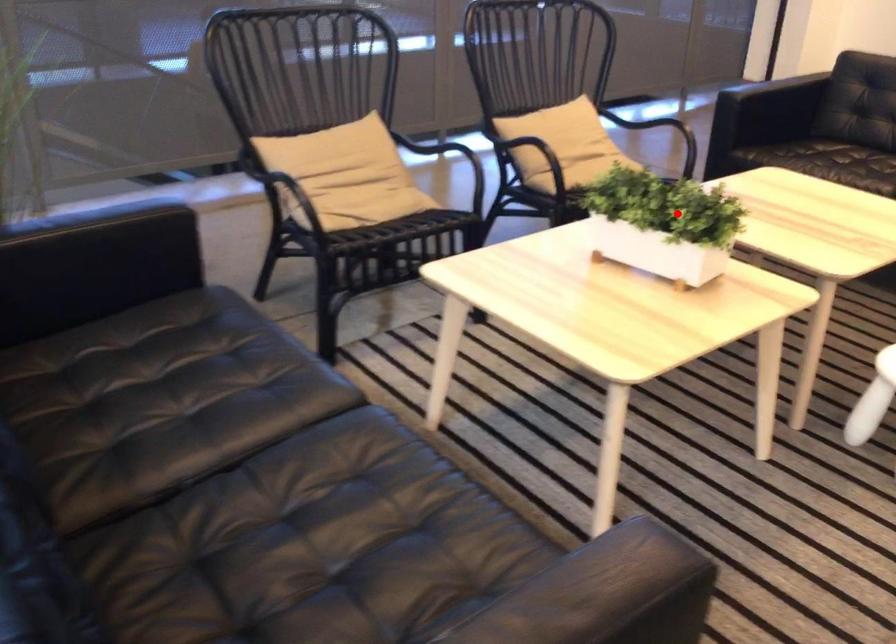
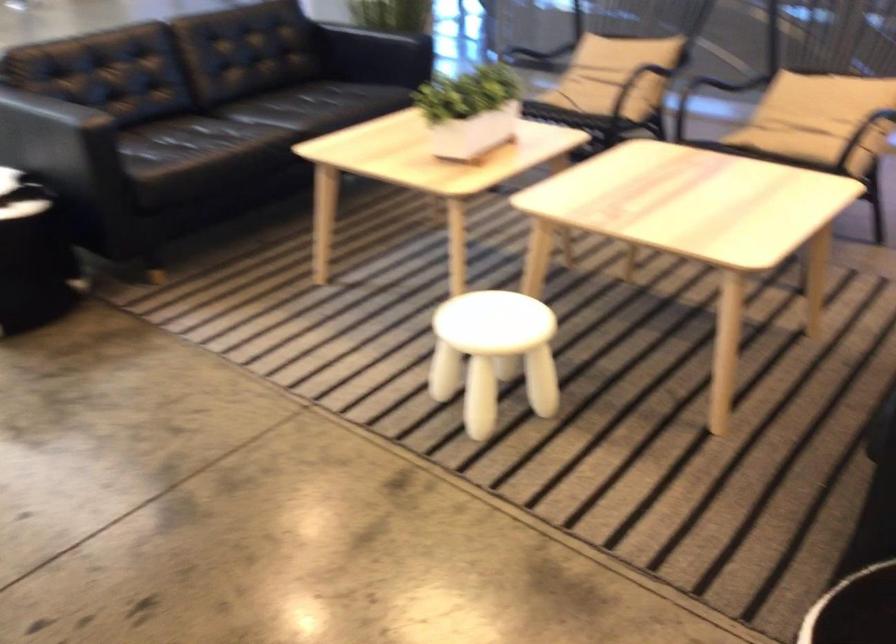
Question: A red point is marked in image1. In image2, is the corresponding 3D point closer to the camera or farther? Reply with the corresponding letter.

Choices:
 (A) The corresponding 3D point is closer.
 (B) The corresponding 3D point is farther.

Answer: (B)